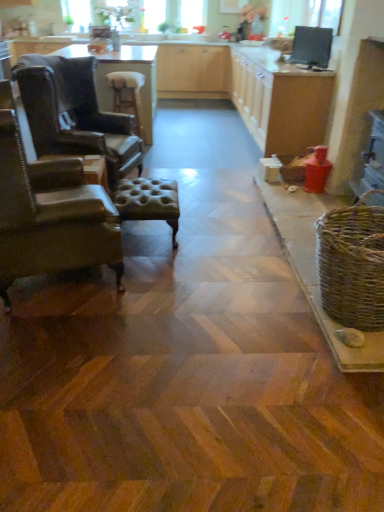
Question: Is matte wood counter top at center positioned with its back to woven brown basket at right?

Choices:
 (A) yes
 (B) no

Answer: (B)

Question: Does matte wood counter top at center appear on the right side of woven brown basket at right?

Choices:
 (A) yes
 (B) no

Answer: (B)

Question: Is matte wood counter top at center outside of woven brown basket at right?

Choices:
 (A) yes
 (B) no

Answer: (A)

Question: Is woven brown basket at right surrounded by matte wood counter top at center?

Choices:
 (A) yes
 (B) no

Answer: (B)

Question: Is the depth of matte wood counter top at center greater than that of woven brown basket at right?

Choices:
 (A) no
 (B) yes

Answer: (B)

Question: Does matte wood counter top at center lie in front of woven brown basket at right?

Choices:
 (A) yes
 (B) no

Answer: (B)

Question: Does leather armchair at left, which is the 1th chair from front to back, have a lesser width compared to leather wingback chair at left, which is the 1th chair in back-to-front order?

Choices:
 (A) no
 (B) yes

Answer: (B)

Question: Is leather armchair at left, which is the 1th chair from front to back, closer to the viewer compared to leather wingback chair at left, which is the 1th chair in back-to-front order?

Choices:
 (A) yes
 (B) no

Answer: (A)

Question: Considering the relative sizes of leather armchair at left, which is the 1th chair from front to back, and leather wingback chair at left, the second chair when ordered from front to back, in the image provided, is leather armchair at left, which is the 1th chair from front to back, wider than leather wingback chair at left, the second chair when ordered from front to back,?

Choices:
 (A) yes
 (B) no

Answer: (B)

Question: Can you confirm if leather armchair at left, which is the 1th chair from front to back, is shorter than leather wingback chair at left, the second chair when ordered from front to back?

Choices:
 (A) yes
 (B) no

Answer: (A)

Question: Is leather armchair at left, which is the 1th chair from front to back, taller than leather wingback chair at left, which is the 1th chair in back-to-front order?

Choices:
 (A) yes
 (B) no

Answer: (B)

Question: From the image's perspective, is leather armchair at left, the second chair viewed from the back, below leather wingback chair at left, which is the 1th chair in back-to-front order?

Choices:
 (A) no
 (B) yes

Answer: (B)

Question: Considering the relative positions of woven brown basket at right and matte wood counter top at center in the image provided, is woven brown basket at right behind matte wood counter top at center?

Choices:
 (A) no
 (B) yes

Answer: (A)